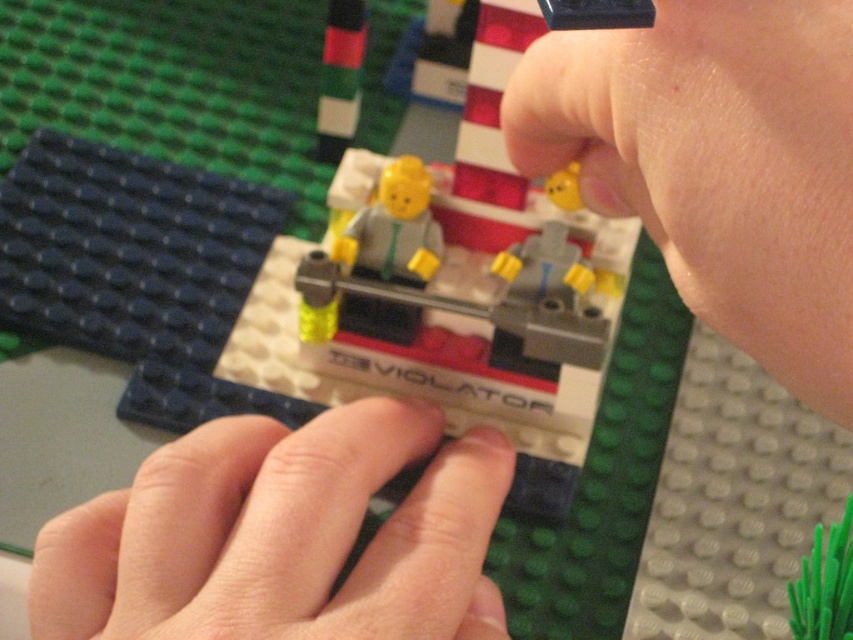
Is smooth skin at upper right shorter than smooth skin at center?

Incorrect, smooth skin at upper right's height does not fall short of smooth skin at center's.

Is smooth skin at upper right closer to camera compared to smooth skin at center?

Yes, it is in front of smooth skin at center.

Is point (762, 88) behind point (49, 570)?

No, it is not.

Find the location of a particular element. The width and height of the screenshot is (853, 640). smooth skin at upper right is located at coordinates (718, 164).

Can you confirm if smooth skin at center is positioned below matte gray figure at center?

Yes, smooth skin at center is below matte gray figure at center.

Does smooth skin at center have a greater height compared to matte gray figure at center?

Yes.

This screenshot has height=640, width=853. Identify the location of smooth skin at center. (282, 536).

Who is higher up, smooth skin at upper right or matte gray figure at center?

matte gray figure at center is above.

Does smooth skin at upper right have a lesser width compared to matte gray figure at center?

In fact, smooth skin at upper right might be wider than matte gray figure at center.

Is point (779, 374) closer to camera compared to point (410, 259)?

Yes.

The height and width of the screenshot is (640, 853). I want to click on smooth skin at upper right, so click(x=718, y=164).